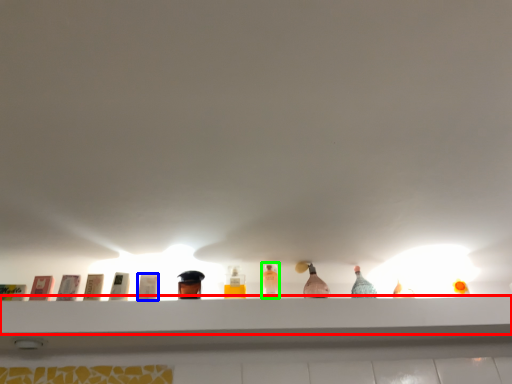
Question: Which is farther away from shelf (highlighted by a red box)? toiletry (highlighted by a blue box) or bottle (highlighted by a green box)?

Choices:
 (A) toiletry
 (B) bottle

Answer: (A)